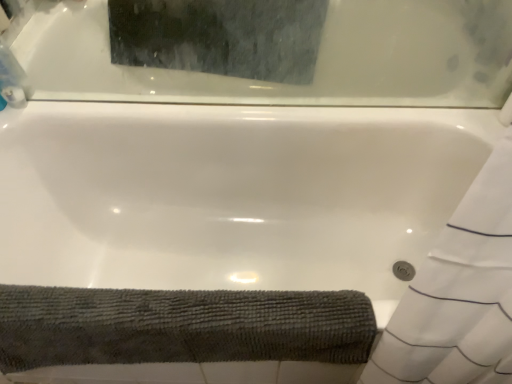
Question: Considering the relative positions of white glossy bathtub at upper center and clear plastic bottle at upper left in the image provided, is white glossy bathtub at upper center to the right of clear plastic bottle at upper left from the viewer's perspective?

Choices:
 (A) yes
 (B) no

Answer: (A)

Question: Does white glossy bathtub at upper center have a lesser height compared to clear plastic bottle at upper left?

Choices:
 (A) no
 (B) yes

Answer: (A)

Question: From the image's perspective, is white glossy bathtub at upper center on clear plastic bottle at upper left?

Choices:
 (A) no
 (B) yes

Answer: (B)

Question: Considering the relative sizes of white glossy bathtub at upper center and clear plastic bottle at upper left in the image provided, is white glossy bathtub at upper center wider than clear plastic bottle at upper left?

Choices:
 (A) no
 (B) yes

Answer: (A)

Question: Considering the relative sizes of white glossy bathtub at upper center and clear plastic bottle at upper left in the image provided, is white glossy bathtub at upper center bigger than clear plastic bottle at upper left?

Choices:
 (A) no
 (B) yes

Answer: (B)

Question: Does white glossy bathtub at upper center appear on the left side of clear plastic bottle at upper left?

Choices:
 (A) yes
 (B) no

Answer: (B)

Question: Does clear plastic bottle at upper left have a greater width compared to dark gray textured bath towel at lower left?

Choices:
 (A) yes
 (B) no

Answer: (B)

Question: From the image's perspective, is clear plastic bottle at upper left located above dark gray textured bath towel at lower left?

Choices:
 (A) no
 (B) yes

Answer: (B)

Question: Can you confirm if clear plastic bottle at upper left is bigger than dark gray textured bath towel at lower left?

Choices:
 (A) no
 (B) yes

Answer: (A)

Question: Does clear plastic bottle at upper left appear on the left side of dark gray textured bath towel at lower left?

Choices:
 (A) yes
 (B) no

Answer: (A)

Question: Is clear plastic bottle at upper left completely or partially outside of dark gray textured bath towel at lower left?

Choices:
 (A) no
 (B) yes

Answer: (B)

Question: From the image's perspective, would you say clear plastic bottle at upper left is shown under dark gray textured bath towel at lower left?

Choices:
 (A) no
 (B) yes

Answer: (A)

Question: Does white glossy bathtub at upper center appear on the right side of dark gray textured bath towel at lower left?

Choices:
 (A) yes
 (B) no

Answer: (A)